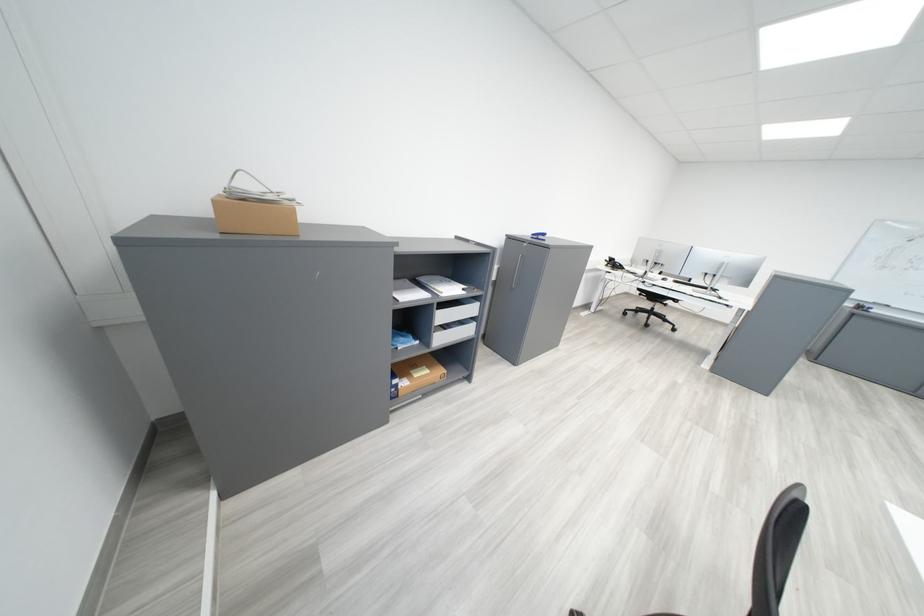
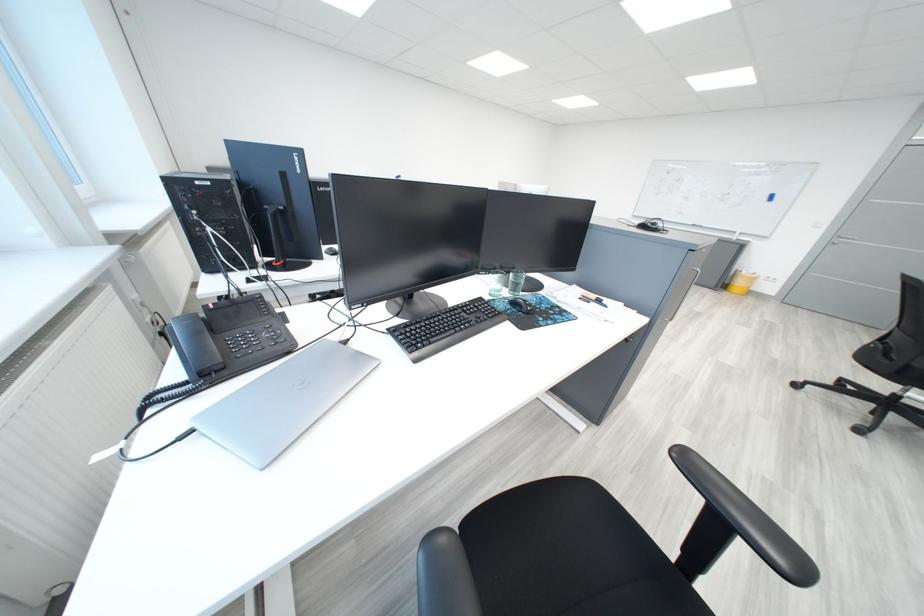
What movement of the cameraman would produce the second image?

The movement direction of the cameraman is right, backward.